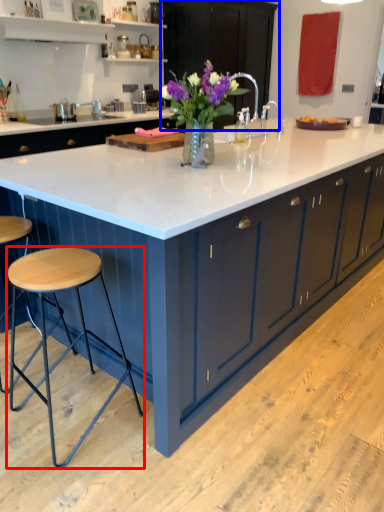
Question: Among these objects, which one is farthest to the camera, stool (highlighted by a red box) or cabinetry (highlighted by a blue box)?

Choices:
 (A) stool
 (B) cabinetry

Answer: (B)